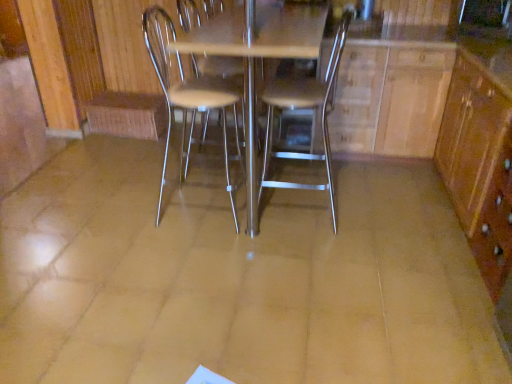
Where is `vacant area that is in front of metallic silver table at center`? Image resolution: width=512 pixels, height=384 pixels. vacant area that is in front of metallic silver table at center is located at coordinates (209, 314).